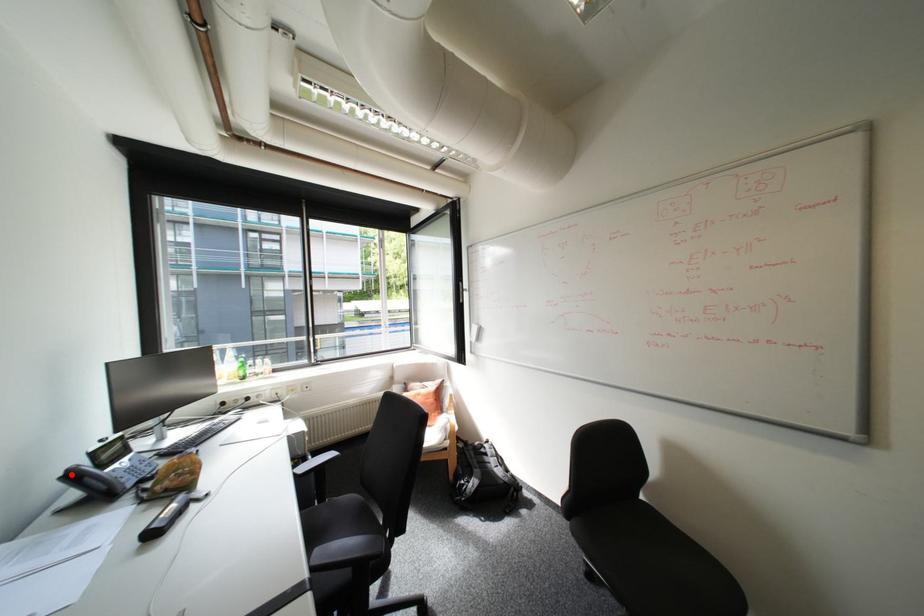
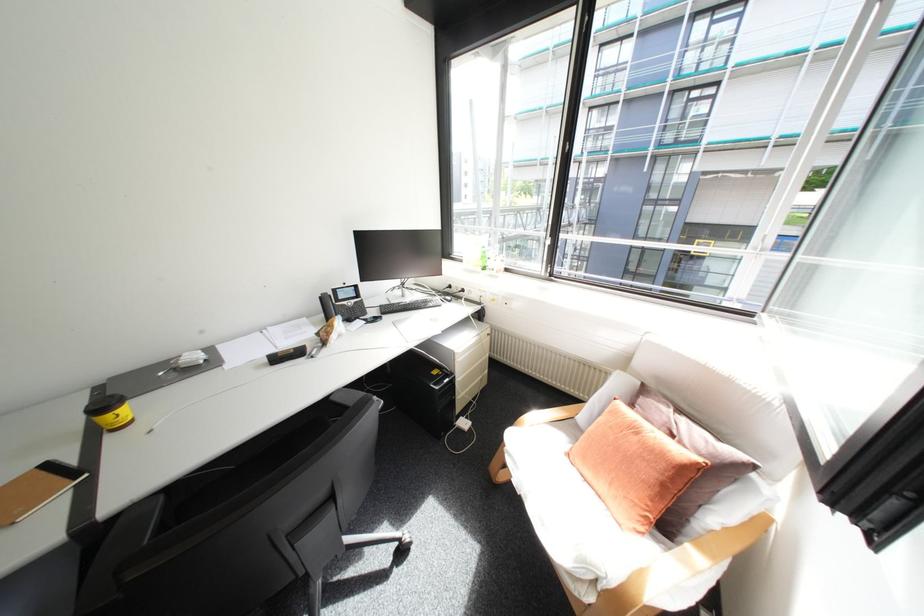
Where in the second image is the point corresponding to the highlighted location from the first image?

(330, 296)